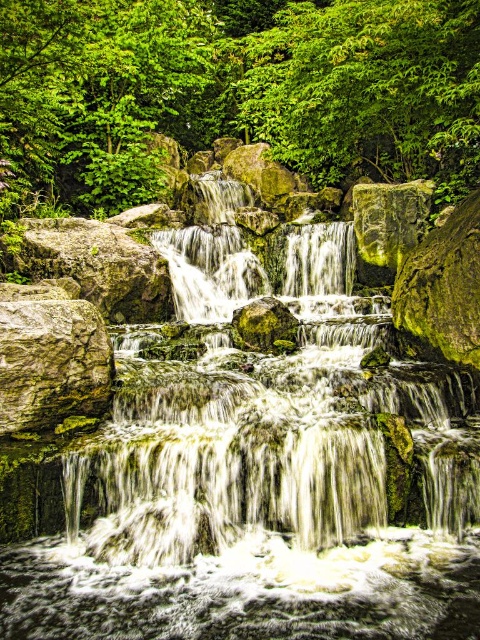
Question: Is green mossy rocks at center smaller than green leafy tree at upper center?

Choices:
 (A) yes
 (B) no

Answer: (A)

Question: Among these points, which one is farthest from the camera?

Choices:
 (A) (59, 413)
 (B) (410, 291)
 (C) (58, 99)
 (D) (108, 291)

Answer: (C)

Question: In this image, where is rough textured rock at left located relative to green mossy rock at center-right?

Choices:
 (A) left
 (B) right

Answer: (A)

Question: Which object is the closest to the green mossy rock at center-right?

Choices:
 (A) green leafy tree at upper center
 (B) rough textured rock at left
 (C) green mossy rock at left
 (D) green mossy rocks at center

Answer: (D)

Question: Which object appears closest to the camera in this image?

Choices:
 (A) green mossy rock at center-right
 (B) rough textured rock at left
 (C) green leafy tree at upper center

Answer: (B)

Question: Does green leafy tree at upper center appear over rough textured rock at left?

Choices:
 (A) no
 (B) yes

Answer: (B)